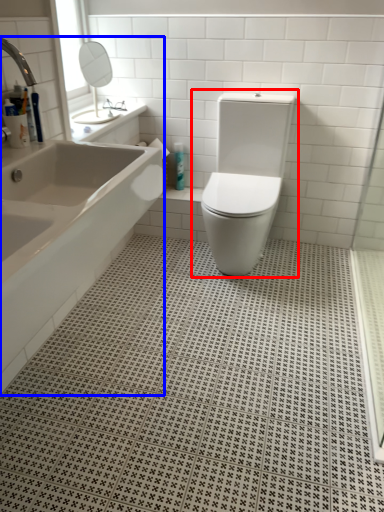
Question: Which object appears closest to the camera in this image, toilet (highlighted by a red box) or bathtub (highlighted by a blue box)?

Choices:
 (A) toilet
 (B) bathtub

Answer: (B)